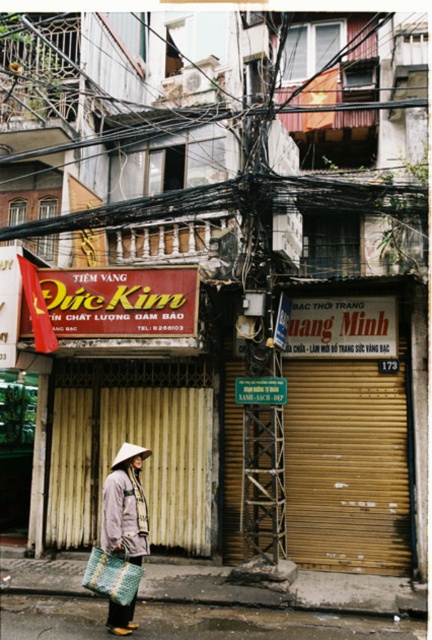
Is point (146, 584) closer to camera compared to point (104, 528)?

No, (146, 584) is further to viewer.

Where is `matte fabric bag at lower center`? The image size is (432, 640). matte fabric bag at lower center is located at coordinates (270, 605).

Based on the photo, between matte fabric bag at lower center and light gray woven hat at lower left, which one is positioned lower?

matte fabric bag at lower center is lower down.

Find the location of a particular element. This screenshot has width=432, height=640. matte fabric bag at lower center is located at coordinates (270, 605).

Is point (311, 600) closer to camera compared to point (110, 508)?

That is False.

Where is `matte fabric bag at lower center`? This screenshot has width=432, height=640. matte fabric bag at lower center is located at coordinates (270, 605).

Is light gray woven hat at lower left below gray textured coat at center?

Actually, light gray woven hat at lower left is above gray textured coat at center.

Identify the location of light gray woven hat at lower left. Image resolution: width=432 pixels, height=640 pixels. (124, 506).